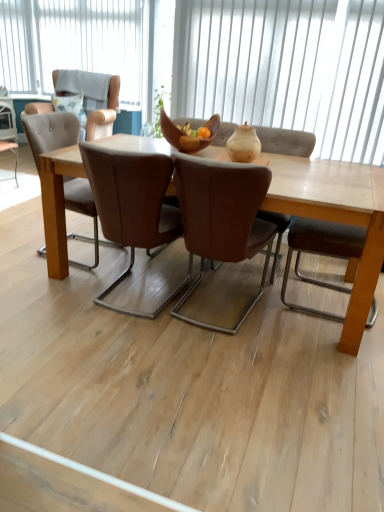
The height and width of the screenshot is (512, 384). I want to click on free space behind brown leather chair at center, which is counted as the 1th chair, starting from the right, so click(223, 267).